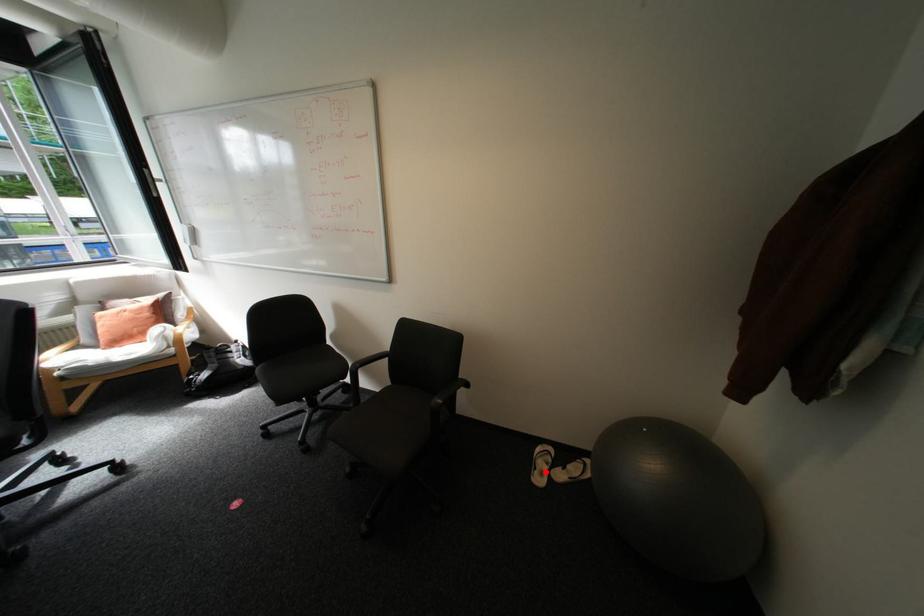
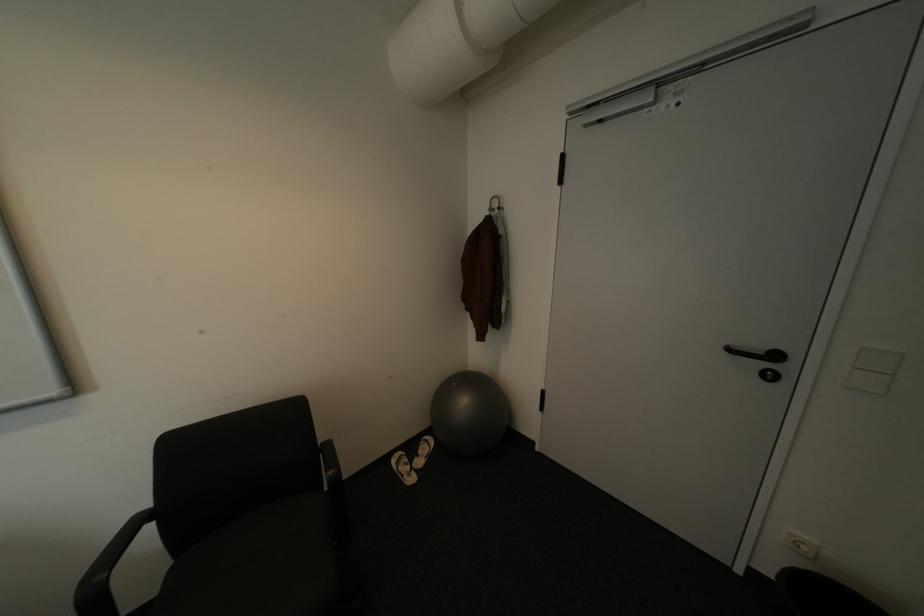
In the second image, find the point that corresponds to the highlighted location in the first image.

(415, 477)